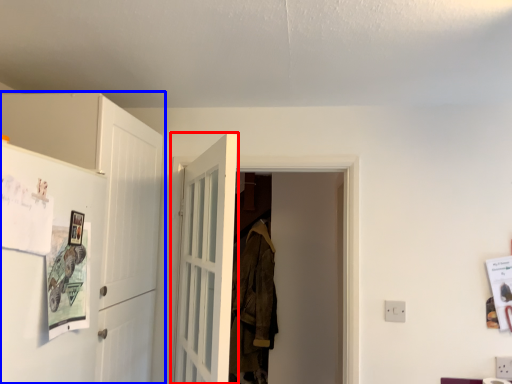
Question: Which object is further to the camera taking this photo, door (highlighted by a red box) or cabinetry (highlighted by a blue box)?

Choices:
 (A) door
 (B) cabinetry

Answer: (B)